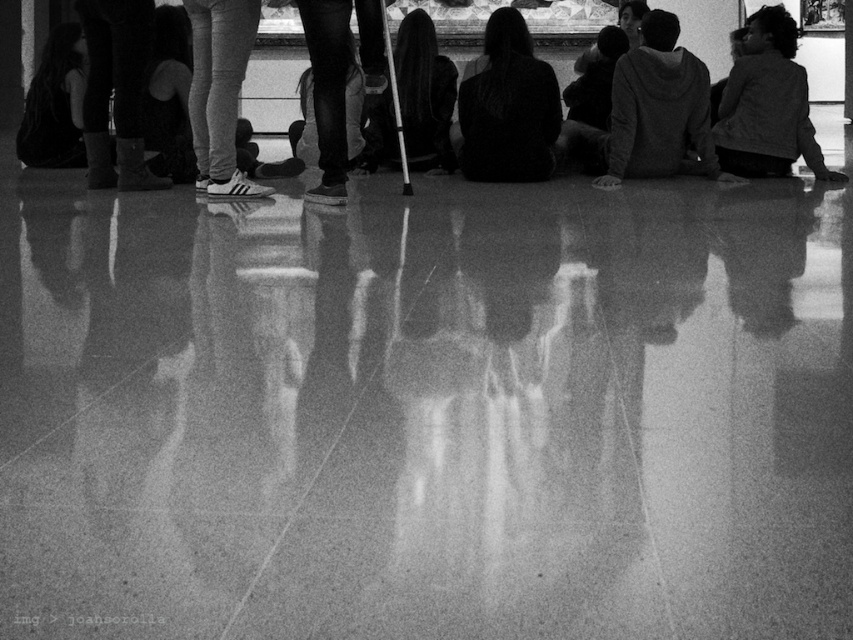
You are an art student analyzing the photograph. You notice two elements in the scene that are important for your analysis. The first is the dark hair at center, and the second is the dark gray hoodie at upper right. Based on their positions, which one is closer to the camera?

The dark hair at center is above the dark gray hoodie at upper right, meaning the dark hair at center is closer to the camera.

You are an observer standing in front of the group. Which object is positioned to the left of the other between the gray hoodie at center and the dark hair at center?

The dark hair at center is positioned to the left of the gray hoodie at center.

You are an observer looking at the scene. There are two hoodies in the image, the gray hoodie at center and the dark gray hoodie at upper right. Which hoodie is positioned lower in the image?

The gray hoodie at center is positioned lower in the image because it is below the dark gray hoodie at upper right.